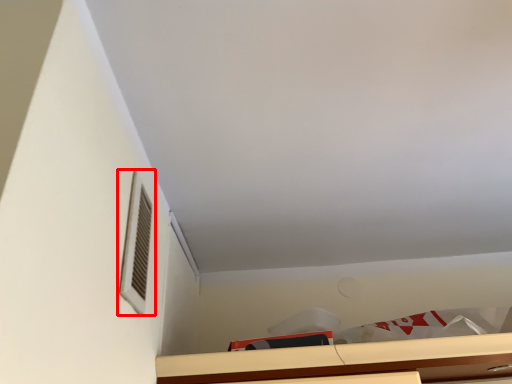
Question: In this image, where is window (annotated by the red box) located relative to cabinetry?

Choices:
 (A) left
 (B) right

Answer: (A)